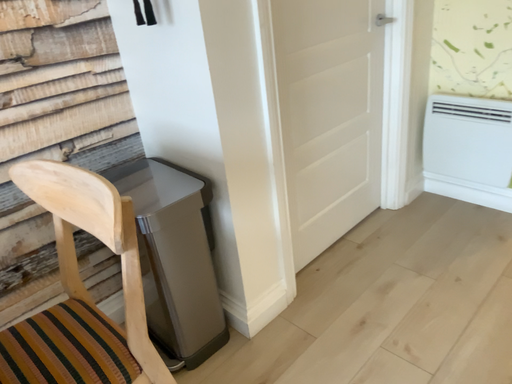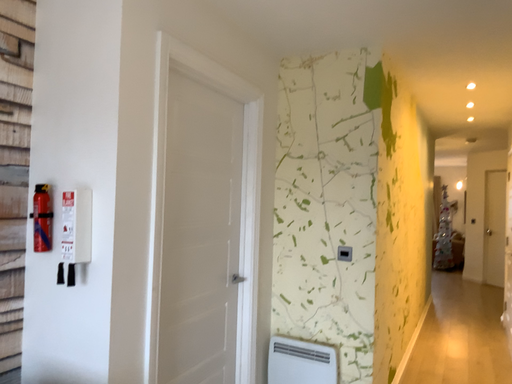
Question: How did the camera likely rotate when shooting the video?

Choices:
 (A) rotated left
 (B) rotated right

Answer: (B)